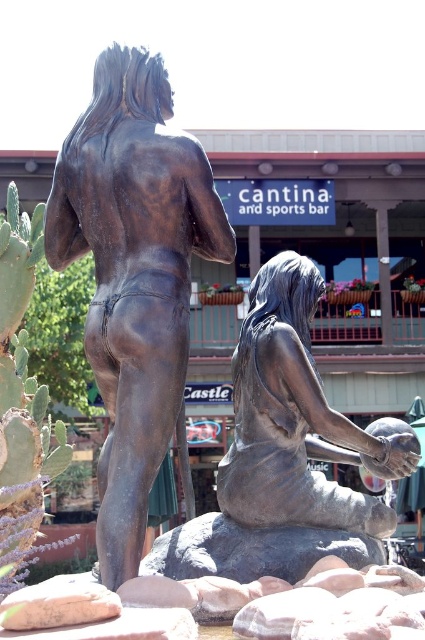
You are an art student analyzing the composition of the sculpture. Which object corresponds to the coordinates point [135,276]?

The point [135,276] corresponds to the bronze statue at left.

You are an art curator planning to install two bronze statues in a gallery. The statues are labeled as the bronze statue at left and bronze statue at center. Given their sizes, which statue should be placed closer to the entrance to ensure visitors notice the larger one first upon entering?

The bronze statue at left is much taller than the bronze statue at center, so it should be placed closer to the entrance to ensure visitors notice the larger one first upon entering.

You are an art curator planning to photograph the bronze statue at left and the bronze statue at center. To ensure both are fully visible in the frame, which statue should you position closer to the camera?

You should position the bronze statue at left closer to the camera because it is already in front of the bronze statue at center, so moving it forward will keep both statues visible without one blocking the other.